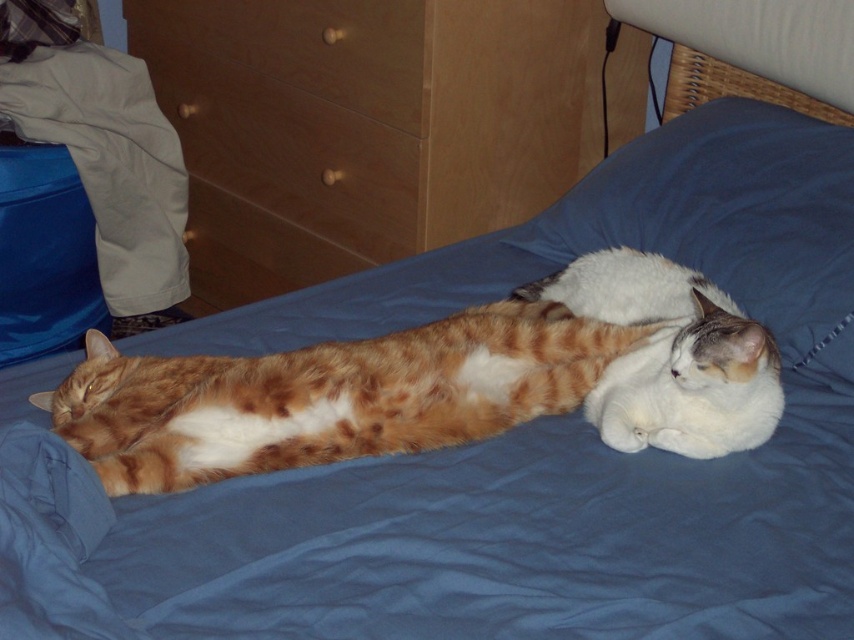
Question: Which of these objects is positioned farthest from the orange tabby cat at center?

Choices:
 (A) wooden drawer at upper center
 (B) wooden drawer at upper left
 (C) white fluffy cat at center
 (D) wooden dresser at upper left

Answer: (B)

Question: Can you confirm if white fluffy cat at center is bigger than wooden drawer at upper center?

Choices:
 (A) yes
 (B) no

Answer: (B)

Question: Does wooden dresser at upper left appear under wooden drawer at upper center?

Choices:
 (A) yes
 (B) no

Answer: (A)

Question: Does wooden dresser at upper left have a greater width compared to white fluffy cat at center?

Choices:
 (A) yes
 (B) no

Answer: (A)

Question: Estimate the real-world distances between objects in this image. Which object is farther from the orange tabby cat at center?

Choices:
 (A) white fluffy cat at center
 (B) wooden drawer at upper center
 (C) wooden dresser at upper left

Answer: (B)

Question: Which point appears closest to the camera in this image?

Choices:
 (A) (556, 176)
 (B) (231, 35)
 (C) (396, 196)

Answer: (C)